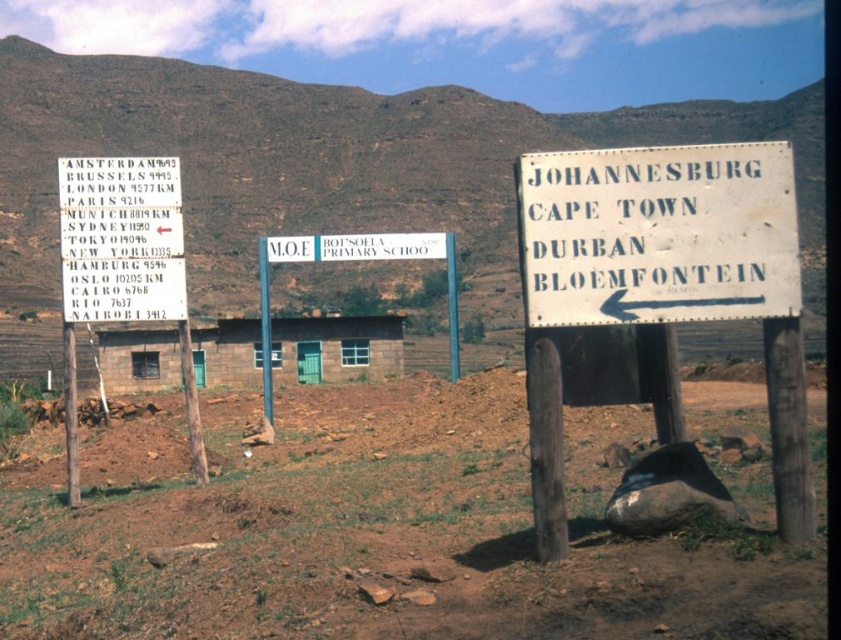
You are standing in front of the small stone building with a corrugated metal roof. You see the brown soil at center and the white painted wood sign at right. Which object is closer to you?

The brown soil at center is closer to you because it is in front of the white painted wood sign at right.

You are standing at the point marked as point (x=368, y=531) in the image. What is the color of the ground beneath your feet?

The ground beneath your feet at point (x=368, y=531) is brown soil at center.